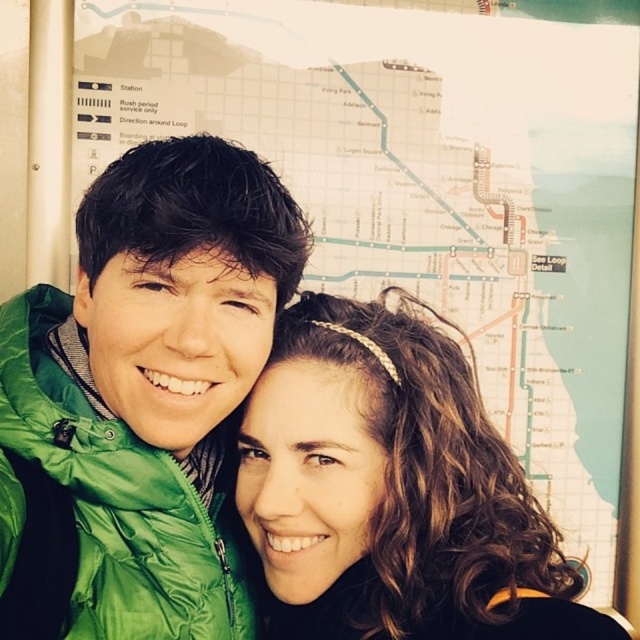
Question: Does green puffy jacket at left appear on the left side of brown curly hair at center?

Choices:
 (A) yes
 (B) no

Answer: (A)

Question: Which of the following is the farthest from the observer?

Choices:
 (A) brown curly hair at center
 (B) green puffy jacket at left

Answer: (A)

Question: Considering the relative positions of green puffy jacket at left and brown curly hair at center in the image provided, where is green puffy jacket at left located with respect to brown curly hair at center?

Choices:
 (A) left
 (B) right

Answer: (A)

Question: Is green puffy jacket at left above brown curly hair at center?

Choices:
 (A) no
 (B) yes

Answer: (B)